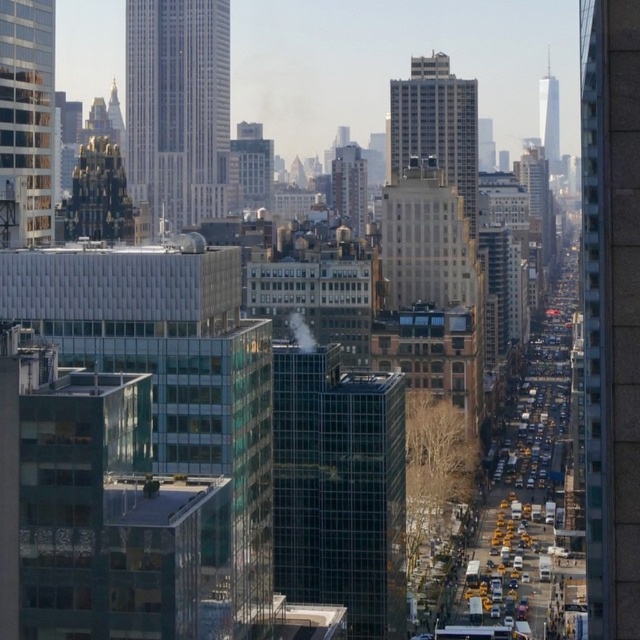
Question: Which point appears closest to the camera in this image?

Choices:
 (A) (636, 221)
 (B) (132, 54)
 (C) (547, 97)

Answer: (A)

Question: From the image, what is the correct spatial relationship of white glass skyscraper at upper left in relation to beige concrete building at center?

Choices:
 (A) below
 (B) above

Answer: (B)

Question: Does brick textured building at right have a smaller size compared to white glass tower at upper right?

Choices:
 (A) yes
 (B) no

Answer: (B)

Question: Is brick textured building at right to the right of white glass tower at upper right from the viewer's perspective?

Choices:
 (A) yes
 (B) no

Answer: (A)

Question: Which point is closer to the camera taking this photo?

Choices:
 (A) (588, 444)
 (B) (353, 150)

Answer: (B)

Question: Which point is farther from the camera taking this photo?

Choices:
 (A) (634, 12)
 (B) (138, 195)
 (C) (426, 109)

Answer: (B)